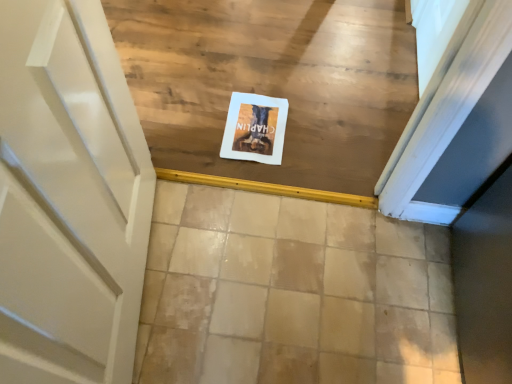
Where is `empty space that is ontop of beige tile at center`? The height and width of the screenshot is (384, 512). empty space that is ontop of beige tile at center is located at coordinates (314, 289).